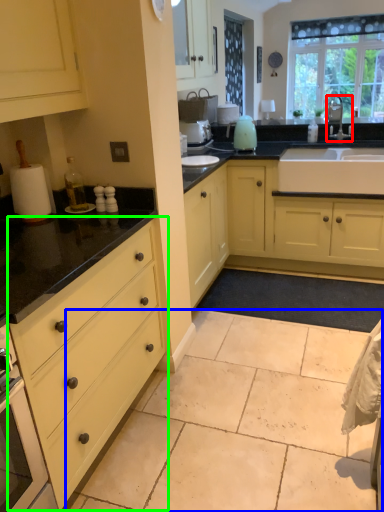
Question: Considering the real-world distances, which object is farthest from tap (highlighted by a red box)? granite (highlighted by a blue box) or drawer (highlighted by a green box)?

Choices:
 (A) granite
 (B) drawer

Answer: (B)